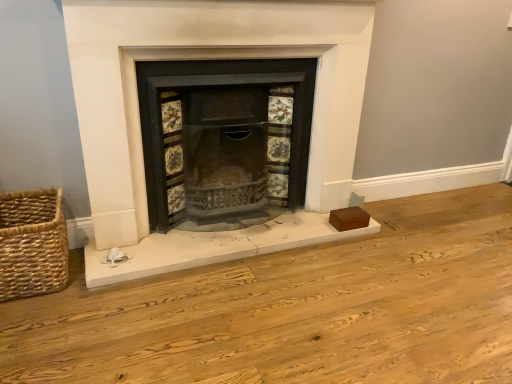
Identify the location of unoccupied area in front of woven straw basket at lower left. (35, 318).